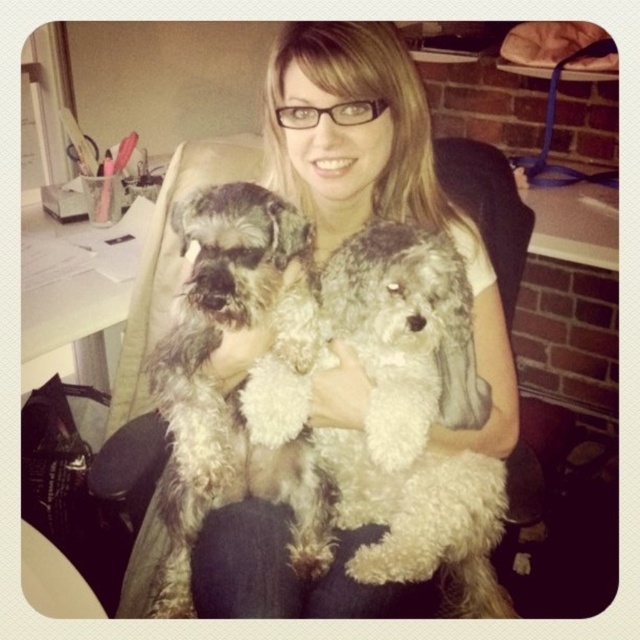
You are a photographer trying to capture a closeup of the fuzzy gray dog at center without including the smooth blonde hair at center in the frame. Based on their positions, can you position yourself to the left or right side of the person to achieve this?

Since the smooth blonde hair at center is to the right of the fuzzy gray dog at center, positioning yourself to the left side of the person would keep the smooth blonde hair at center out of the frame, allowing you to focus on the fuzzy gray dog at center.

In the scene shown: You are a photographer trying to capture a portrait of the person holding the dogs. Given the smooth blonde hair at center and the fuzzy gray dog at center, which one should you focus on first to ensure proper framing?

The smooth blonde hair at center has a greater height compared to the fuzzy gray dog at center, so you should focus on the smooth blonde hair at center first to ensure proper framing.

You are a photographer trying to take a clear picture of both the fuzzy white dog at center and the fuzzy gray dog at center. Which dog might be partially hidden in the photo?

The fuzzy gray dog at center is behind the fuzzy white dog at center, so it might be partially hidden in the photo.